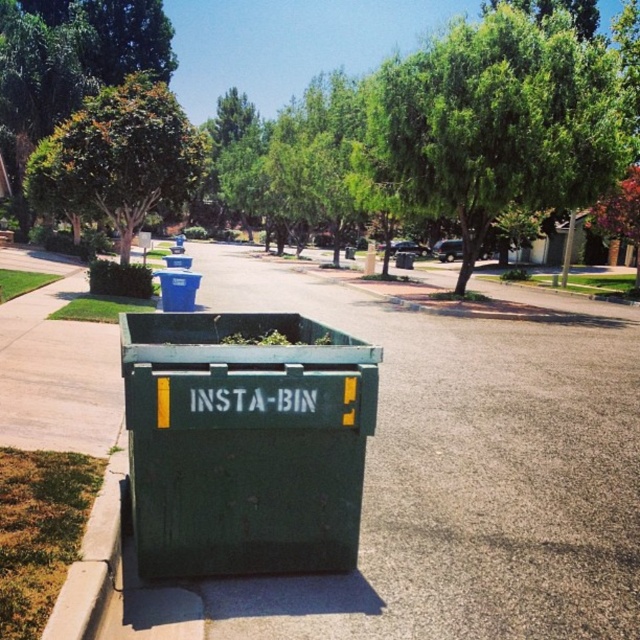
Question: From the image, what is the correct spatial relationship of green leafy tree at upper center in relation to blue plastic bin at center?

Choices:
 (A) above
 (B) below

Answer: (A)

Question: Does green matte recycling bin at center have a lesser width compared to green grass at lower left?

Choices:
 (A) yes
 (B) no

Answer: (B)

Question: Which object is positioned farthest from the green leafy tree at upper left?

Choices:
 (A) blue plastic bin at center
 (B) blue plastic recycling bin at upper left
 (C) green leafy tree at upper center
 (D) green grass at lower left

Answer: (D)

Question: Can you confirm if green matte recycling bin at center is smaller than green leafy tree at upper left?

Choices:
 (A) no
 (B) yes

Answer: (B)

Question: Which of these objects is positioned farthest from the green grass at lower left?

Choices:
 (A) green leafy tree at upper center
 (B) green asphalt pavement at center

Answer: (A)

Question: Which object is the farthest from the green leafy tree at upper center?

Choices:
 (A) blue plastic bin at center
 (B) green leafy tree at upper left
 (C) green asphalt pavement at center
 (D) green matte recycling bin at center

Answer: (D)